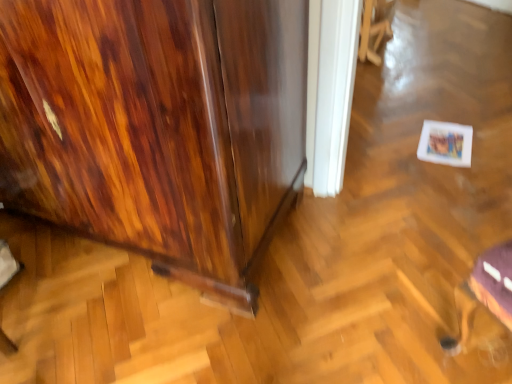
How much space does metallic silver swivel chair at lower right, the first swivel chair when ordered from front to back, occupy horizontally?

32.14 centimeters.

Image resolution: width=512 pixels, height=384 pixels. I want to click on metallic silver swivel chair at lower right, the first swivel chair when ordered from front to back, so click(484, 293).

From a real-world perspective, is wooden swivel chair at upper center, acting as the 1th swivel chair starting from the back, below wooden cabinet at left?

Yes, from a real-world perspective, wooden swivel chair at upper center, acting as the 1th swivel chair starting from the back, is under wooden cabinet at left.

Which object is more forward, wooden swivel chair at upper center, acting as the 1th swivel chair starting from the back, or wooden cabinet at left?

wooden cabinet at left is in front.

From the picture: Is wooden cabinet at left completely or partially inside wooden swivel chair at upper center, the 2th swivel chair in the bottom-to-top sequence?

Definitely not — wooden cabinet at left is not inside wooden swivel chair at upper center, the 2th swivel chair in the bottom-to-top sequence.

Considering the relative positions of wooden cabinet at left and wooden swivel chair at upper center, which is the first swivel chair in top-to-bottom order, in the image provided, is wooden cabinet at left to the left or to the right of wooden swivel chair at upper center, which is the first swivel chair in top-to-bottom order,?

wooden cabinet at left is to the left of wooden swivel chair at upper center, which is the first swivel chair in top-to-bottom order.

Is wooden cabinet at left beside wooden swivel chair at upper center, acting as the 1th swivel chair starting from the back?

wooden cabinet at left is not next to wooden swivel chair at upper center, acting as the 1th swivel chair starting from the back, and they're not touching.

Considering the points (123, 158) and (392, 0), which point is behind, point (123, 158) or point (392, 0)?

The point (392, 0) is farther.

Does wooden cabinet at left turn towards wooden swivel chair at upper center, positioned as the 2th swivel chair in front-to-back order?

No, wooden cabinet at left is not oriented towards wooden swivel chair at upper center, positioned as the 2th swivel chair in front-to-back order.

From the picture: From a real-world perspective, is metallic silver swivel chair at lower right, the 2th swivel chair viewed from the back, physically below wooden cabinet at left?

Indeed, from a real-world perspective, metallic silver swivel chair at lower right, the 2th swivel chair viewed from the back, is positioned beneath wooden cabinet at left.

From the image's perspective, which is below, metallic silver swivel chair at lower right, which is the first swivel chair in bottom-to-top order, or wooden cabinet at left?

metallic silver swivel chair at lower right, which is the first swivel chair in bottom-to-top order.

Is the position of metallic silver swivel chair at lower right, the 2th swivel chair viewed from the back, more distant than that of wooden cabinet at left?

Yes, metallic silver swivel chair at lower right, the 2th swivel chair viewed from the back, is further from the camera.

Which object is wider, metallic silver swivel chair at lower right, the first swivel chair when ordered from front to back, or wooden cabinet at left?

wooden cabinet at left is wider.

Which object is wider, wooden swivel chair at upper center, acting as the 1th swivel chair starting from the back, or metallic silver swivel chair at lower right, arranged as the 2th swivel chair when viewed from the top?

Wider between the two is metallic silver swivel chair at lower right, arranged as the 2th swivel chair when viewed from the top.

What's the angular difference between wooden swivel chair at upper center, the 2th swivel chair in the bottom-to-top sequence, and metallic silver swivel chair at lower right, the 2th swivel chair viewed from the back,'s facing directions?

wooden swivel chair at upper center, the 2th swivel chair in the bottom-to-top sequence, and metallic silver swivel chair at lower right, the 2th swivel chair viewed from the back, are facing 129 degrees away from each other.

Are wooden swivel chair at upper center, the 2th swivel chair in the bottom-to-top sequence, and metallic silver swivel chair at lower right, the 2th swivel chair viewed from the back, far apart?

Yes, wooden swivel chair at upper center, the 2th swivel chair in the bottom-to-top sequence, and metallic silver swivel chair at lower right, the 2th swivel chair viewed from the back, are quite far apart.

From their relative heights in the image, would you say wooden swivel chair at upper center, the 2th swivel chair in the bottom-to-top sequence, is taller or shorter than metallic silver swivel chair at lower right, the 2th swivel chair viewed from the back?

In the image, wooden swivel chair at upper center, the 2th swivel chair in the bottom-to-top sequence, appears to be shorter than metallic silver swivel chair at lower right, the 2th swivel chair viewed from the back.

Is metallic silver swivel chair at lower right, the first swivel chair when ordered from front to back, at the back of wooden cabinet at left?

No, metallic silver swivel chair at lower right, the first swivel chair when ordered from front to back, is not at the back of wooden cabinet at left.

Consider the image. From a real-world perspective, is wooden cabinet at left beneath metallic silver swivel chair at lower right, the first swivel chair when ordered from front to back?

No.

Between point (197, 94) and point (492, 301), which one is positioned behind?

The point (492, 301) is behind.

Measure the distance from wooden cabinet at left to metallic silver swivel chair at lower right, the 2th swivel chair viewed from the back.

wooden cabinet at left and metallic silver swivel chair at lower right, the 2th swivel chair viewed from the back, are 30.39 inches apart from each other.

Considering the relative sizes of metallic silver swivel chair at lower right, the 2th swivel chair viewed from the back, and wooden swivel chair at upper center, positioned as the 2th swivel chair in front-to-back order, in the image provided, is metallic silver swivel chair at lower right, the 2th swivel chair viewed from the back, shorter than wooden swivel chair at upper center, positioned as the 2th swivel chair in front-to-back order,?

In fact, metallic silver swivel chair at lower right, the 2th swivel chair viewed from the back, may be taller than wooden swivel chair at upper center, positioned as the 2th swivel chair in front-to-back order.

Locate an element on the screen. The image size is (512, 384). swivel chair to the right of metallic silver swivel chair at lower right, the first swivel chair when ordered from front to back is located at coordinates (375, 28).

Is the depth of metallic silver swivel chair at lower right, which is the first swivel chair in bottom-to-top order, less than that of wooden swivel chair at upper center, positioned as the 2th swivel chair in front-to-back order?

Yes, the depth of metallic silver swivel chair at lower right, which is the first swivel chair in bottom-to-top order, is less than that of wooden swivel chair at upper center, positioned as the 2th swivel chair in front-to-back order.

Is metallic silver swivel chair at lower right, arranged as the 2th swivel chair when viewed from the top, beside wooden swivel chair at upper center, acting as the 1th swivel chair starting from the back?

No, metallic silver swivel chair at lower right, arranged as the 2th swivel chair when viewed from the top, is not touching wooden swivel chair at upper center, acting as the 1th swivel chair starting from the back.

Where is `furniture above the wooden swivel chair at upper center, positioned as the 2th swivel chair in front-to-back order (from a real-world perspective)`? furniture above the wooden swivel chair at upper center, positioned as the 2th swivel chair in front-to-back order (from a real-world perspective) is located at coordinates (156, 125).

The width and height of the screenshot is (512, 384). I want to click on the 2nd swivel chair counting from the right of the wooden cabinet at left, so click(x=375, y=28).

Considering their positions, is wooden swivel chair at upper center, acting as the 1th swivel chair starting from the back, positioned further to metallic silver swivel chair at lower right, which is the first swivel chair in bottom-to-top order, than wooden cabinet at left?

wooden swivel chair at upper center, acting as the 1th swivel chair starting from the back, is positioned further to the anchor metallic silver swivel chair at lower right, which is the first swivel chair in bottom-to-top order.

From the image, which object appears to be nearer to metallic silver swivel chair at lower right, the first swivel chair when ordered from front to back, wooden cabinet at left or wooden swivel chair at upper center, which is the first swivel chair in top-to-bottom order?

wooden cabinet at left.

Which object lies further to the anchor point wooden swivel chair at upper center, positioned as the 2th swivel chair in front-to-back order, wooden cabinet at left or metallic silver swivel chair at lower right, arranged as the 2th swivel chair when viewed from the top?

The object further to wooden swivel chair at upper center, positioned as the 2th swivel chair in front-to-back order, is metallic silver swivel chair at lower right, arranged as the 2th swivel chair when viewed from the top.

Considering their positions, is metallic silver swivel chair at lower right, the first swivel chair when ordered from front to back, positioned further to wooden swivel chair at upper center, which is the first swivel chair in top-to-bottom order, than wooden cabinet at left?

Among the two, metallic silver swivel chair at lower right, the first swivel chair when ordered from front to back, is located further to wooden swivel chair at upper center, which is the first swivel chair in top-to-bottom order.

Looking at the image, which one is located further to wooden cabinet at left, wooden swivel chair at upper center, which is the first swivel chair in top-to-bottom order, or metallic silver swivel chair at lower right, arranged as the 2th swivel chair when viewed from the top?

Among the two, wooden swivel chair at upper center, which is the first swivel chair in top-to-bottom order, is located further to wooden cabinet at left.

Looking at the image, which one is located further to wooden cabinet at left, metallic silver swivel chair at lower right, arranged as the 2th swivel chair when viewed from the top, or wooden swivel chair at upper center, the 2th swivel chair in the bottom-to-top sequence?

Based on the image, wooden swivel chair at upper center, the 2th swivel chair in the bottom-to-top sequence, appears to be further to wooden cabinet at left.

Find the location of a particular element. The image size is (512, 384). swivel chair between wooden cabinet at left and wooden swivel chair at upper center, which is the first swivel chair in top-to-bottom order, from front to back is located at coordinates (484, 293).